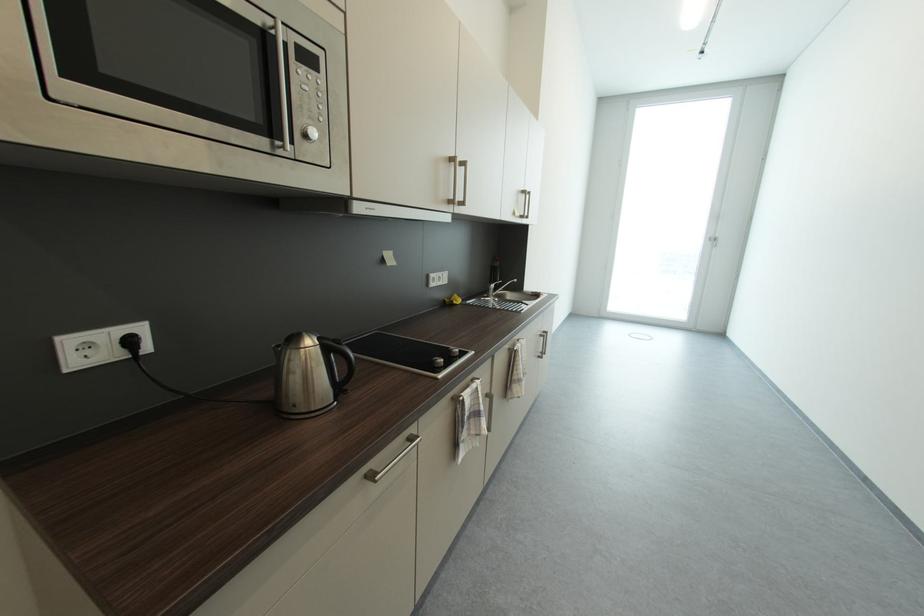
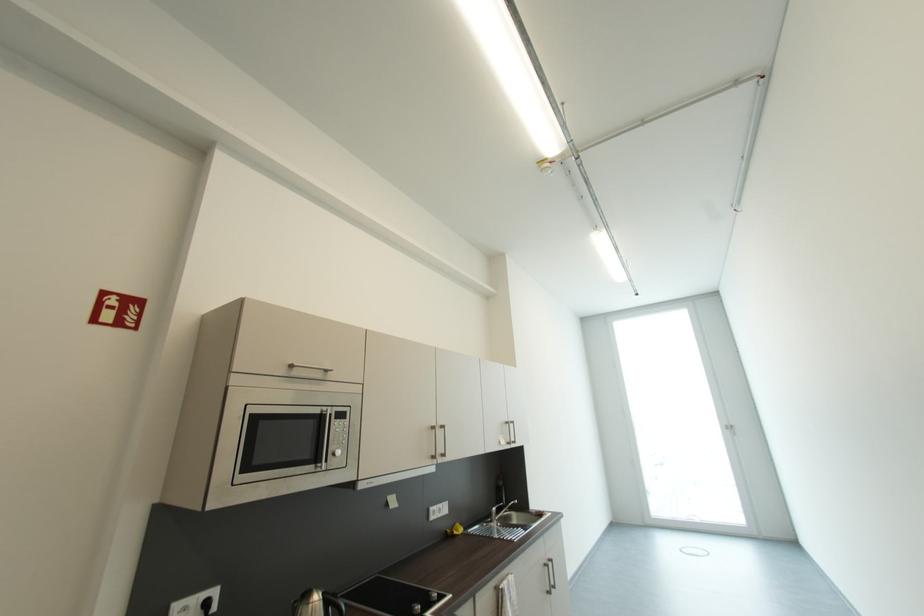
In the second image, find the point that corresponds to the point at 492,297 in the first image.

(495, 522)